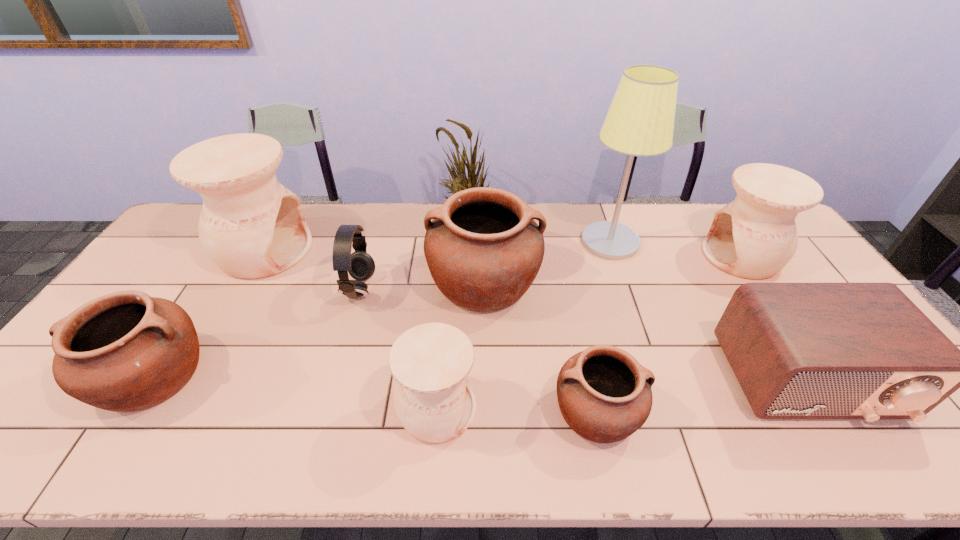
Find the location of a particular element. This screenshot has width=960, height=540. the smallest cream pottery is located at coordinates (433, 400).

Image resolution: width=960 pixels, height=540 pixels. Find the location of `the second cream pottery from left to right`. the second cream pottery from left to right is located at coordinates (433, 400).

You are a GUI agent. You are given a task and a screenshot of the screen. Output one action in this format:
    pyautogui.click(x=<x>, y=<y>)
    Task: Click on the shortest pottery
    
    Given the screenshot: What is the action you would take?
    click(x=603, y=393)

The width and height of the screenshot is (960, 540). I want to click on the shortest object, so click(603, 393).

Find the location of `vacant space located 0.370m on the left of the table lamp`. vacant space located 0.370m on the left of the table lamp is located at coordinates (471, 241).

Locate an element on the screen. The height and width of the screenshot is (540, 960). free location located 0.230m at the open side of the biggest cream pottery is located at coordinates (380, 250).

Locate an element on the screen. This screenshot has width=960, height=540. vacant space located at the open side of the second biggest cream pottery is located at coordinates (670, 256).

Identify the location of vacant space situated at the open side of the second biggest cream pottery. (639, 256).

Identify the location of free space located at the open side of the second biggest cream pottery. (683, 256).

Identify the location of free location located 0.360m on the front of the biggest reddish pottery. (486, 448).